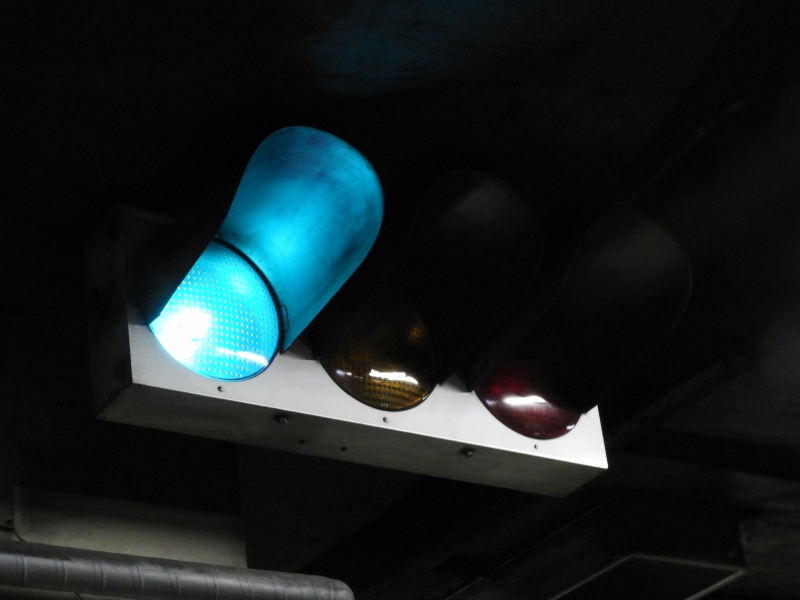
The image size is (800, 600). In order to click on screws in this screenshot , I will do `click(468, 455)`, `click(278, 420)`, `click(214, 388)`, `click(385, 421)`, `click(529, 448)`.